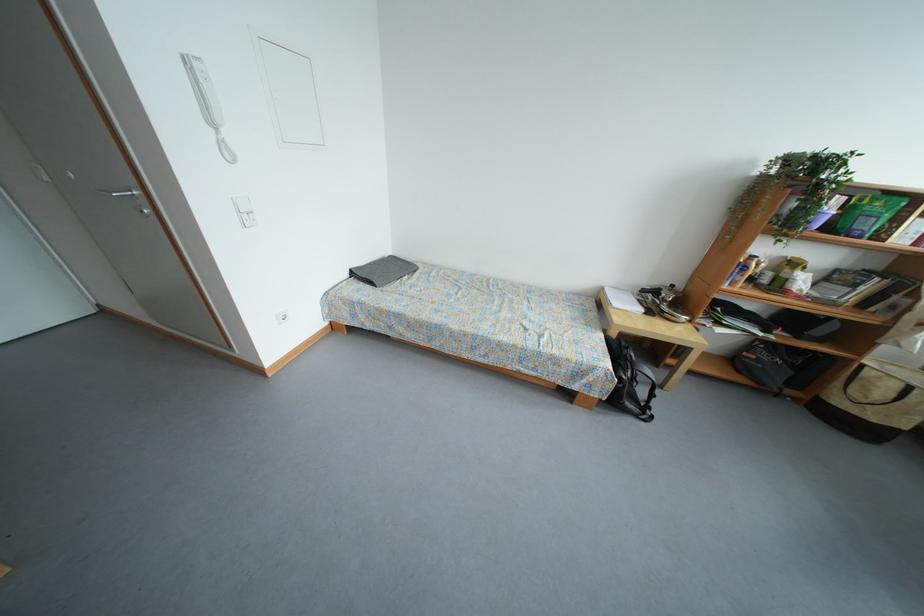
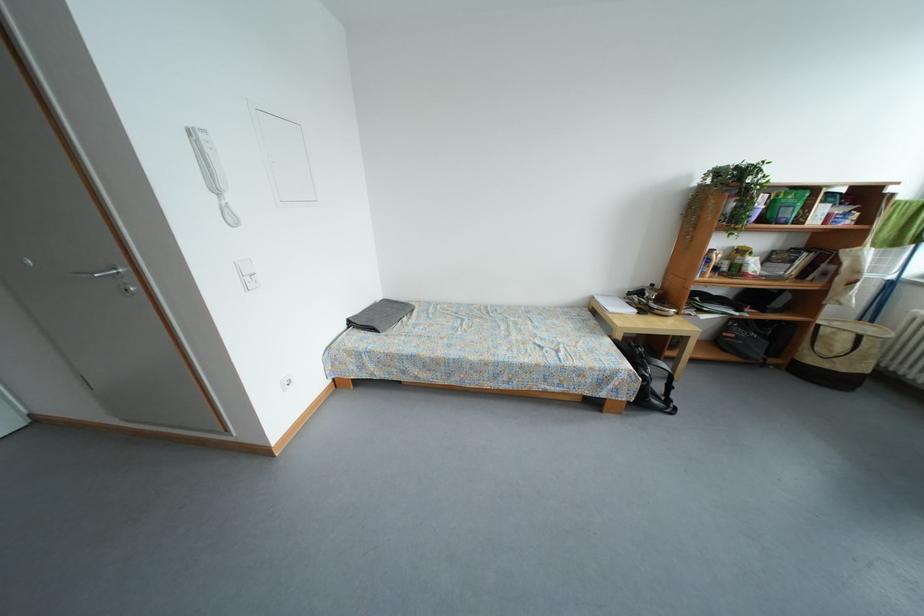
Question: The camera is either moving clockwise (left) or counter-clockwise (right) around the object. The first image is from the beginning of the video and the second image is from the end. Is the camera moving left or right when shooting the video?

Choices:
 (A) Left
 (B) Right

Answer: (A)